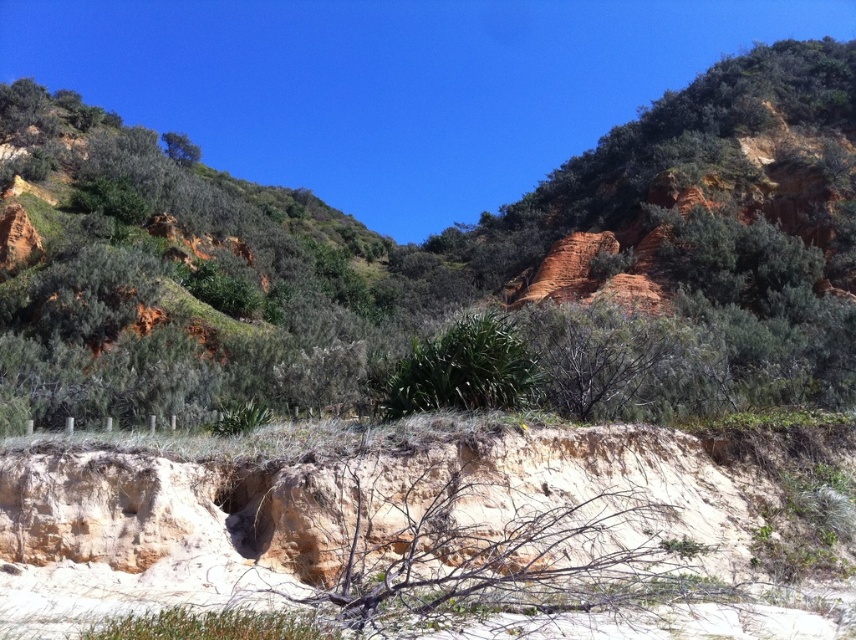
You are a hiker with a 50 meter long rope. You need to secure your equipment between the rustic clay hill at center and the green leafy tree at upper left. Is your rope long enough to stretch between them?

The distance between rustic clay hill at center and green leafy tree at upper left is 61.16 meters. Since your rope is only 50 meters long, it is not long enough to stretch between them.

You are standing on the sand dune in the image and see two points marked on the ground. The first point is at coordinate point (785, 266) and the second at point (183, 156). If you want to walk towards the point that is closer to you, which coordinate should you head towards?

Point (183, 156) is closer to you because it is behind point (785, 266). Since point (785, 266) is in front of point (183, 156), the closer point would be the one in front, which is point (785, 266). Wait, this seems contradictory. Let me clarify. If point A is in front of point B, then point A is closer to the observer. Therefore, to reach the closer point, you should head towards point (785, 266).